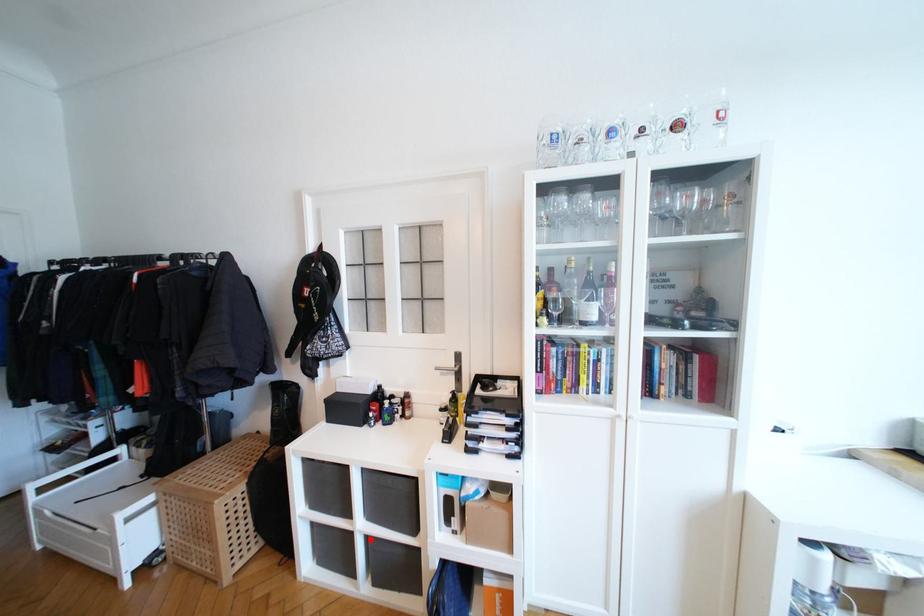
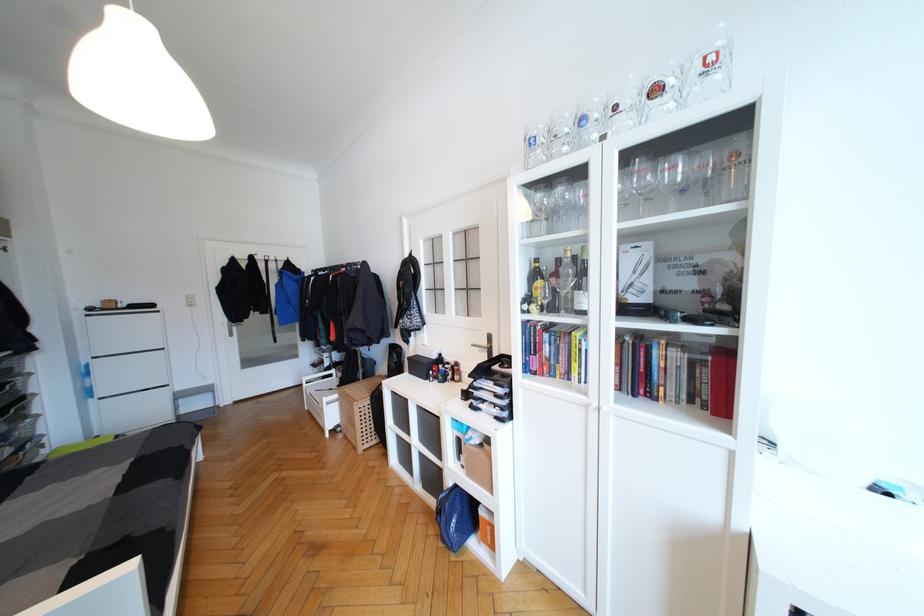
Locate, in the second image, the point that corresponds to the highlighted location in the first image.

(423, 456)